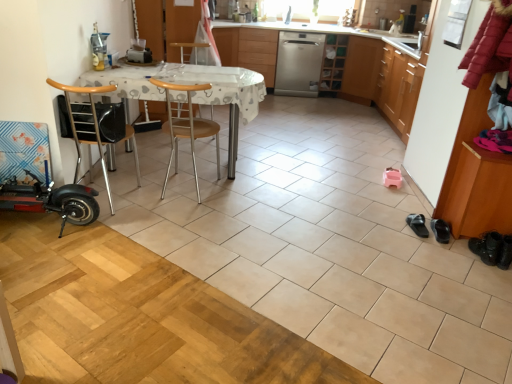
Question: From the image's perspective, is black leather shoes at lower right, which appears as the second footwear when viewed from the right, located above brown wood shoe rack at right, which is the 1th cabinetry from bottom to top?

Choices:
 (A) yes
 (B) no

Answer: (B)

Question: From the image's perspective, does black leather shoes at lower right, acting as the 2th footwear starting from the left, appear lower than brown wood shoe rack at right, the 2th cabinetry viewed from the top?

Choices:
 (A) no
 (B) yes

Answer: (B)

Question: Can brown wood shoe rack at right, positioned as the 1th cabinetry in front-to-back order, be found inside black leather shoes at lower right, which appears as the second footwear when viewed from the right?

Choices:
 (A) no
 (B) yes

Answer: (A)

Question: Is black leather shoes at lower right, which appears as the second footwear when viewed from the right, thinner than brown wood shoe rack at right, arranged as the second cabinetry when viewed from the left?

Choices:
 (A) yes
 (B) no

Answer: (A)

Question: Can you confirm if black leather shoes at lower right, which appears as the second footwear when viewed from the right, is shorter than brown wood shoe rack at right, the 2th cabinetry viewed from the top?

Choices:
 (A) yes
 (B) no

Answer: (A)

Question: Considering the positions of black leather boots at lower right, which is the third footwear from left to right, and silver metallic dishwasher at center, acting as the second cabinetry starting from the front, in the image, is black leather boots at lower right, which is the third footwear from left to right, taller or shorter than silver metallic dishwasher at center, acting as the second cabinetry starting from the front,?

Choices:
 (A) short
 (B) tall

Answer: (A)

Question: Is black leather boots at lower right, the 1th footwear in the right-to-left sequence, in front of or behind silver metallic dishwasher at center, which is counted as the 1th cabinetry, starting from the top, in the image?

Choices:
 (A) front
 (B) behind

Answer: (A)

Question: From a real-world perspective, relative to silver metallic dishwasher at center, the 2th cabinetry from the right, is black leather boots at lower right, the 1th footwear in the right-to-left sequence, vertically above or below?

Choices:
 (A) above
 (B) below

Answer: (B)

Question: From the image's perspective, is black leather boots at lower right, which is the third footwear from left to right, positioned above or below silver metallic dishwasher at center, which appears as the second cabinetry when ordered from the bottom?

Choices:
 (A) above
 (B) below

Answer: (B)

Question: Considering the positions of point (176, 140) and point (295, 91), is point (176, 140) closer or farther from the camera than point (295, 91)?

Choices:
 (A) farther
 (B) closer

Answer: (B)

Question: From the image's perspective, is wooden at center, the 2th chair in the left-to-right sequence, above or below satin silver dishwasher at center?

Choices:
 (A) below
 (B) above

Answer: (A)

Question: Is wooden at center, the first chair viewed from the right, situated inside satin silver dishwasher at center or outside?

Choices:
 (A) outside
 (B) inside

Answer: (A)

Question: Is wooden at center, the 2th chair in the left-to-right sequence, wider or thinner than satin silver dishwasher at center?

Choices:
 (A) thin
 (B) wide

Answer: (A)

Question: From the image's perspective, relative to black leather shoe at lower right, which is the third footwear from right to left, is white plastic table at center above or below?

Choices:
 (A) below
 (B) above

Answer: (B)

Question: Based on their positions, is white plastic table at center located to the left or right of black leather shoe at lower right, marked as the 1th footwear in a left-to-right arrangement?

Choices:
 (A) left
 (B) right

Answer: (A)